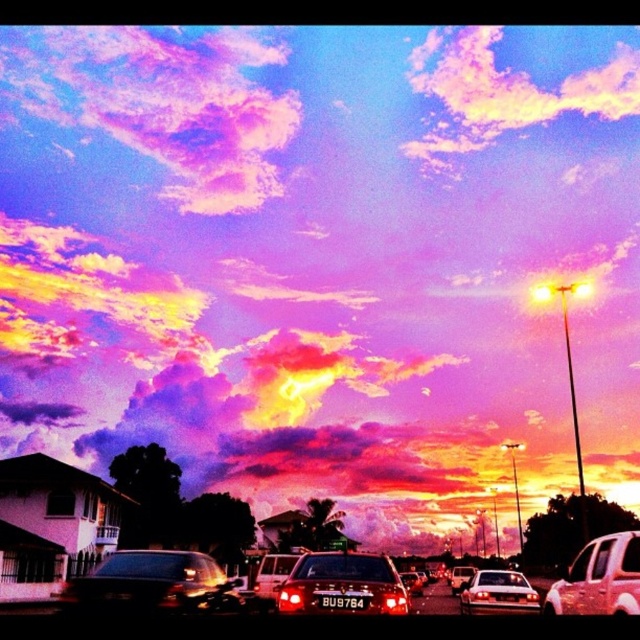
Question: Among these points, which one is nearest to the camera?

Choices:
 (A) (566, 573)
 (B) (337, 604)

Answer: (B)

Question: Which object appears closest to the camera in this image?

Choices:
 (A) purple cotton candy cloud at upper left
 (B) shiny silver sedan at center

Answer: (B)

Question: Where is shiny red car at center located in relation to shiny black sedan at center in the image?

Choices:
 (A) left
 (B) right

Answer: (A)

Question: Is the position of purple cotton candy cloud at upper left more distant than that of black plastic license plate at center?

Choices:
 (A) no
 (B) yes

Answer: (B)

Question: Where is shiny silver sedan at center located in relation to shiny black sedan at center in the image?

Choices:
 (A) right
 (B) left

Answer: (A)

Question: Estimate the real-world distances between objects in this image. Which object is farther from the shiny white sedan at center?

Choices:
 (A) shiny black car at center
 (B) black plastic license plate at center
 (C) shiny red car at center
 (D) purple cotton candy cloud at upper left

Answer: (D)